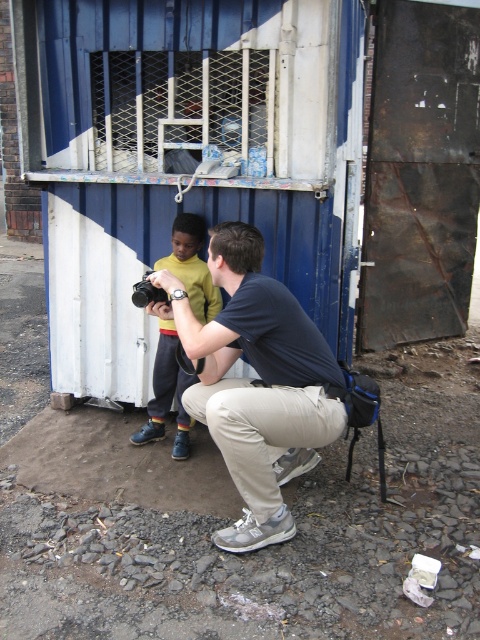
Question: Can you confirm if yellow cotton shirt at center is bigger than black plastic camera at center?

Choices:
 (A) yes
 (B) no

Answer: (A)

Question: Considering the real-world distances, which object is farthest from the yellow cotton shirt at center?

Choices:
 (A) black plastic camera at center
 (B) blue painted metal container at center
 (C) matte blue shirt at center

Answer: (C)

Question: Is matte blue shirt at center wider than yellow cotton shirt at center?

Choices:
 (A) no
 (B) yes

Answer: (B)

Question: From the image, what is the correct spatial relationship of blue painted metal container at center in relation to matte blue shirt at center?

Choices:
 (A) below
 (B) above

Answer: (B)

Question: Which point is farther to the camera?

Choices:
 (A) yellow cotton shirt at center
 (B) blue painted metal container at center

Answer: (A)

Question: Estimate the real-world distances between objects in this image. Which object is farther from the black plastic camera at center?

Choices:
 (A) yellow cotton shirt at center
 (B) blue painted metal container at center

Answer: (B)